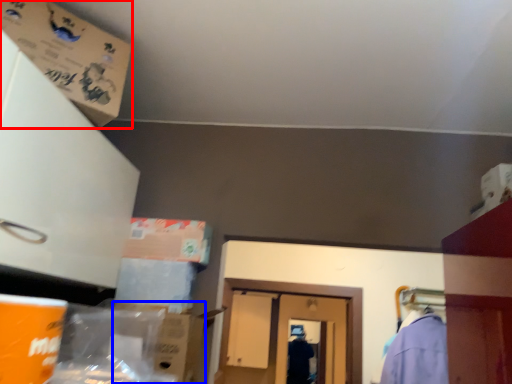
Question: Which point is closer to the camera, cardboard box (highlighted by a red box) or cardboard box (highlighted by a blue box)?

Choices:
 (A) cardboard box
 (B) cardboard box

Answer: (A)